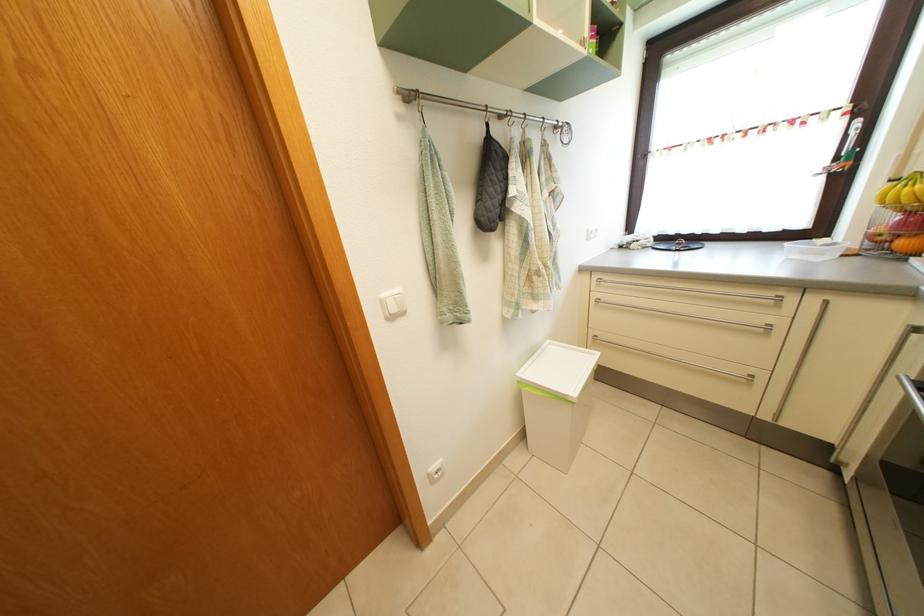
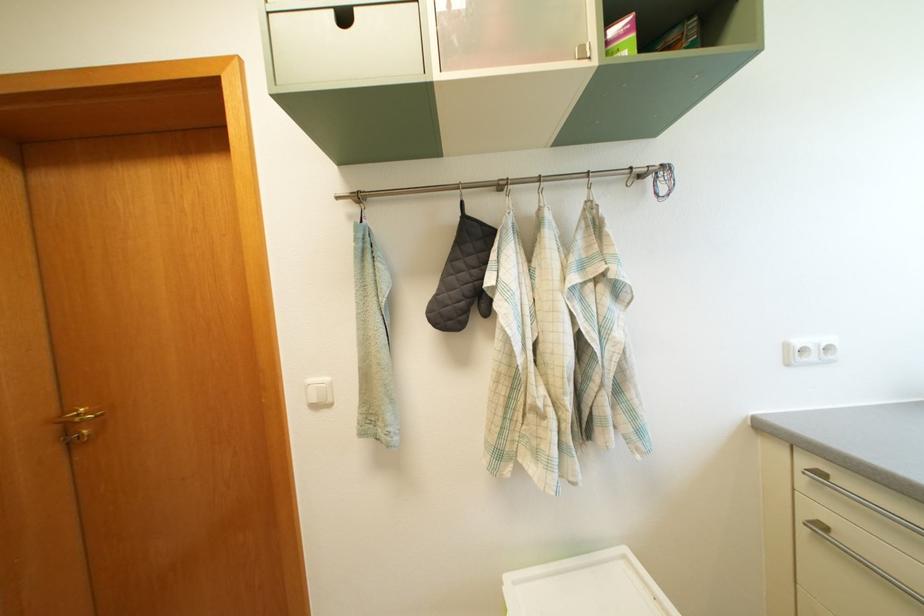
Question: How did the camera likely rotate?

Choices:
 (A) Left
 (B) Right
 (C) Up
 (D) Down

Answer: (A)